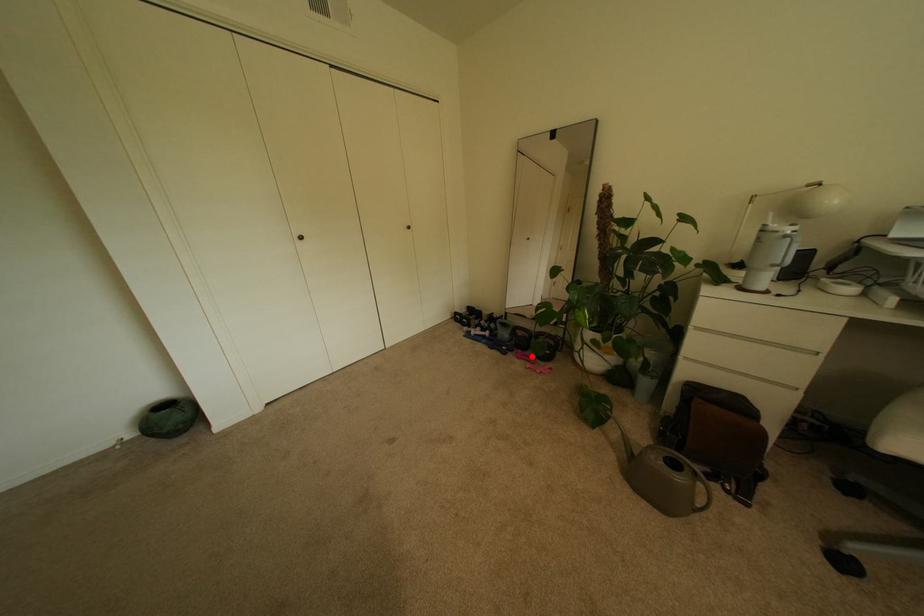
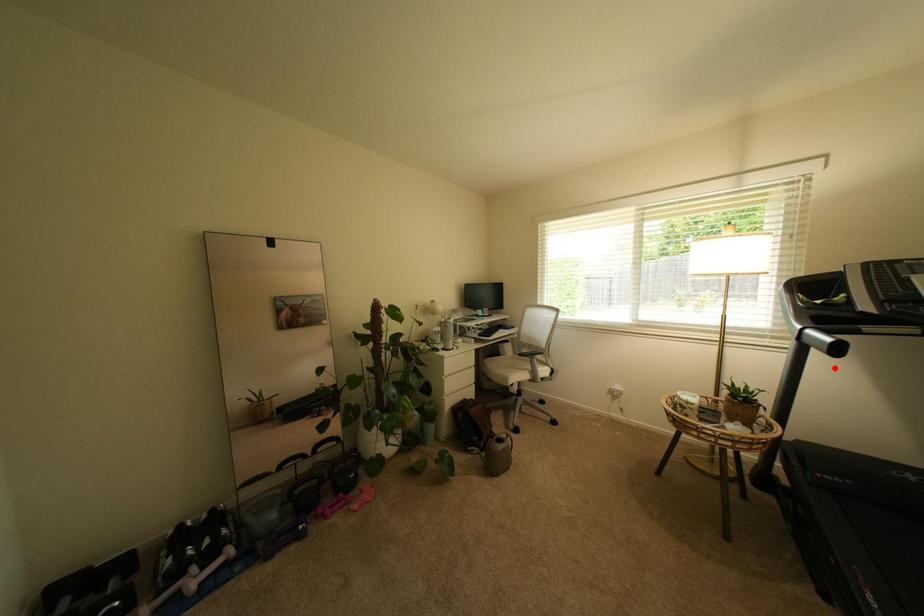
I am providing you with two images of the same scene from different viewpoints. A red point is marked on the first image and another point is marked on the second image. Are the points marked in image1 and image2 representing the same 3D position?

No